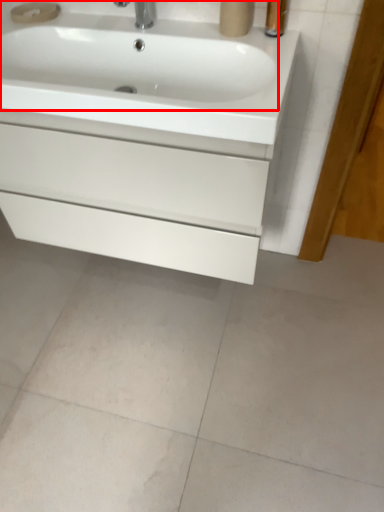
Question: From the image's perspective, where is sink (annotated by the red box) located in relation to bathroom cabinet in the image?

Choices:
 (A) below
 (B) above

Answer: (B)